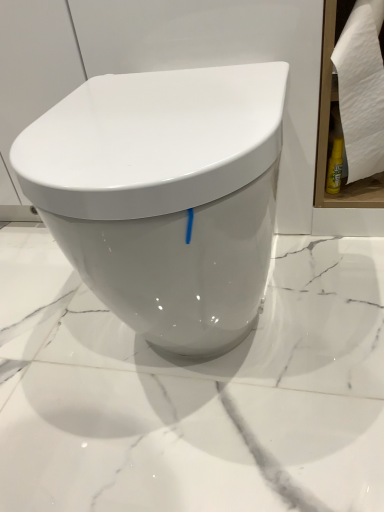
Where is `vacant position to the left of white glossy toilet at center`? The image size is (384, 512). vacant position to the left of white glossy toilet at center is located at coordinates (46, 332).